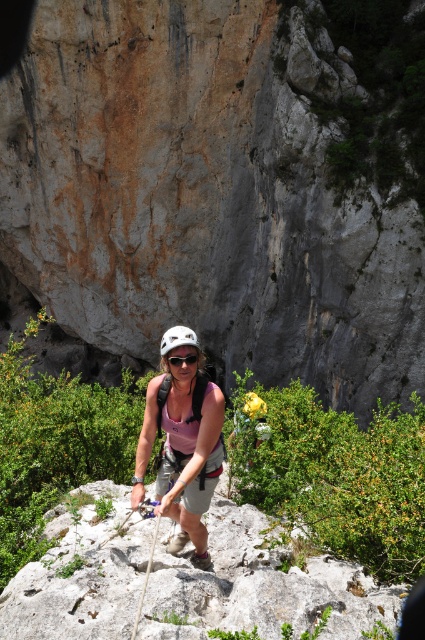
Between pink fabric helmet at center and white matte helmet at center, which one has more height?

white matte helmet at center

Is pink fabric helmet at center behind white matte helmet at center?

That is True.

Does point (190, 344) come closer to viewer compared to point (195, 337)?

That is True.

The height and width of the screenshot is (640, 425). Identify the location of pink fabric helmet at center. (181, 444).

At what (x,y) coordinates should I click in order to perform the action: click on green leafy hillside at center. Please return your answer as a coordinate pair (x, y). The width and height of the screenshot is (425, 640). Looking at the image, I should click on (224, 186).

What do you see at coordinates (224, 186) in the screenshot? This screenshot has height=640, width=425. I see `green leafy hillside at center` at bounding box center [224, 186].

Is point (187, 225) farther from viewer compared to point (161, 342)?

Yes.

At what (x,y) coordinates should I click in order to perform the action: click on green leafy hillside at center. Please return your answer as a coordinate pair (x, y). The width and height of the screenshot is (425, 640). Looking at the image, I should click on (224, 186).

Can you confirm if white matte helmet at center is taller than matte black goggles at center?

Correct, white matte helmet at center is much taller as matte black goggles at center.

Is point (192, 340) positioned before point (195, 369)?

Yes, point (192, 340) is in front of point (195, 369).

Measure the distance between point (181, 324) and camera.

The distance of point (181, 324) from camera is 32.27 meters.

At what (x,y) coordinates should I click in order to perform the action: click on white matte helmet at center. Please return your answer as a coordinate pair (x, y). This screenshot has height=640, width=425. Looking at the image, I should click on (178, 339).